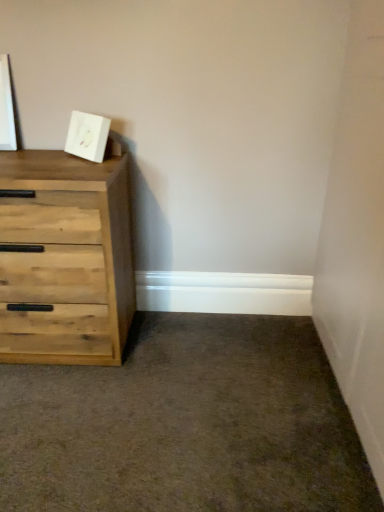
Where is `natural wood chest of drawers at left`? The height and width of the screenshot is (512, 384). natural wood chest of drawers at left is located at coordinates (64, 259).

This screenshot has width=384, height=512. What do you see at coordinates (64, 259) in the screenshot?
I see `natural wood chest of drawers at left` at bounding box center [64, 259].

I want to click on natural wood chest of drawers at left, so click(x=64, y=259).